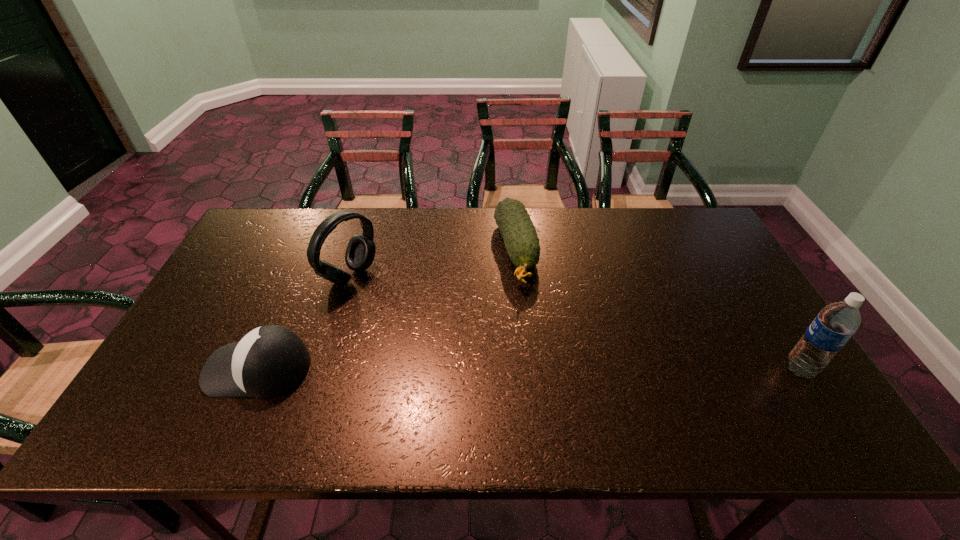
Image resolution: width=960 pixels, height=540 pixels. In order to click on free spot between the cap and the rightmost object in this screenshot , I will do `click(529, 368)`.

Where is `free space between the cap and the tallest object`? Image resolution: width=960 pixels, height=540 pixels. free space between the cap and the tallest object is located at coordinates (529, 368).

In order to click on empty space between the third shortest object and the cucumber in this screenshot , I will do `click(433, 264)`.

Identify the location of free space between the water bottle and the second object from right to left. The image size is (960, 540). (658, 310).

This screenshot has width=960, height=540. I want to click on free space between the third shortest object and the cap, so click(304, 322).

You are a GUI agent. You are given a task and a screenshot of the screen. Output one action in this format:
    pyautogui.click(x=<x>, y=<y>)
    Task: Click on the closest object to the water bottle
    
    Given the screenshot: What is the action you would take?
    pyautogui.click(x=520, y=237)

Select which object appears as the second closest to the headset. Please provide its 2D coordinates. Your answer should be formatted as a tuple, i.e. [(x, y)], where the tuple contains the x and y coordinates of a point satisfying the conditions above.

[(520, 237)]

At what (x,y) coordinates should I click in order to perform the action: click on vacant space that satisfies the following two spatial constraints: 1. on the back side of the second object from right to left; 2. on the right side of the headset. Please return your answer as a coordinate pair (x, y). The height and width of the screenshot is (540, 960). Looking at the image, I should click on (358, 252).